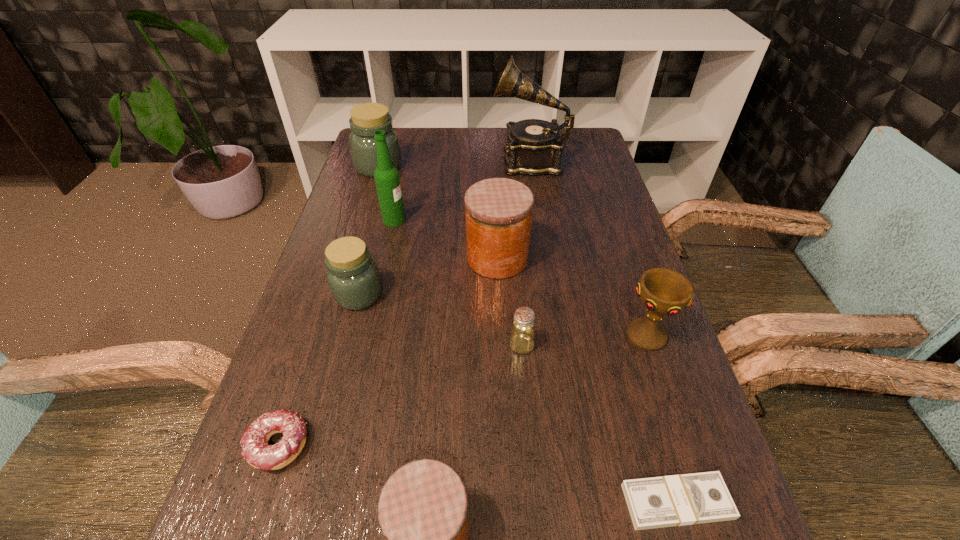
Locate an element on the screen. The width and height of the screenshot is (960, 540). pink doughnut is located at coordinates (256, 451).

Find the location of a particular element. The width and height of the screenshot is (960, 540). dollar is located at coordinates (676, 500).

At what (x,y) coordinates should I click in order to perform the action: click on free region located on the horn of the tallest object. Please return your answer as a coordinate pair (x, y). The width and height of the screenshot is (960, 540). Looking at the image, I should click on (368, 160).

Identify the location of vacant area located 0.130m on the horn of the tallest object. (450, 160).

This screenshot has width=960, height=540. In order to click on vacant area situated on the horn of the tallest object in this screenshot , I will do `click(441, 160)`.

Where is `free space located 0.100m on the label of the green beer bottle`? The image size is (960, 540). free space located 0.100m on the label of the green beer bottle is located at coordinates (444, 220).

At what (x,y) coordinates should I click in order to perform the action: click on vacant space located on the front of the bigger orange jar. Please return your answer as a coordinate pair (x, y). The width and height of the screenshot is (960, 540). Looking at the image, I should click on (504, 418).

Image resolution: width=960 pixels, height=540 pixels. In order to click on vacant area situated 0.110m on the back of the farthest jar in this screenshot , I will do `click(387, 138)`.

Image resolution: width=960 pixels, height=540 pixels. What are the coordinates of `vacant area situated on the back of the chalice` in the screenshot? It's located at point(614,241).

Image resolution: width=960 pixels, height=540 pixels. I want to click on free point located 0.280m on the right of the nearer green jar, so pyautogui.click(x=509, y=295).